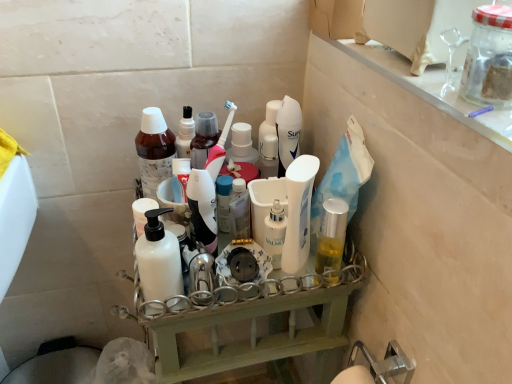
Question: Visually, is brown matte bottle at center, the 1th bottle viewed from the back, positioned to the left or to the right of white matte bottle at center, which ranks as the first bottle in bottom-to-top order?

Choices:
 (A) right
 (B) left

Answer: (B)

Question: Is brown matte bottle at center, the first bottle in the top-to-bottom sequence, situated inside white matte bottle at center, the 1th bottle positioned from the front, or outside?

Choices:
 (A) inside
 (B) outside

Answer: (B)

Question: Which of these objects is positioned closest to the white glossy lotion at center, arranged as the 1th toiletry when viewed from the left?

Choices:
 (A) white plastic shelf at center
 (B) brown matte bottle at center, which is the second bottle from front to back
 (C) white glossy lotion at center
 (D) clear glass shelf at upper right
 (E) white glossy lotion at center, the 2th toiletry viewed from the left

Answer: (E)

Question: Which object is the closest to the brown matte bottle at center, arranged as the 2th bottle when ordered from the bottom?

Choices:
 (A) white glossy lotion at center
 (B) clear glass shelf at upper right
 (C) white glossy lotion at center, placed as the second toiletry when sorted from right to left
 (D) white glossy lotion at center, the 2th toiletry viewed from the left
 (E) white plastic shelf at center

Answer: (C)